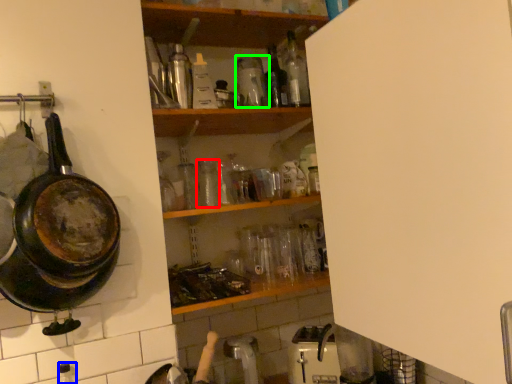
Question: Considering the real-world distances, which object is farthest from bottle (highlighted by a red box)? bottle (highlighted by a blue box) or bottle (highlighted by a green box)?

Choices:
 (A) bottle
 (B) bottle

Answer: (A)